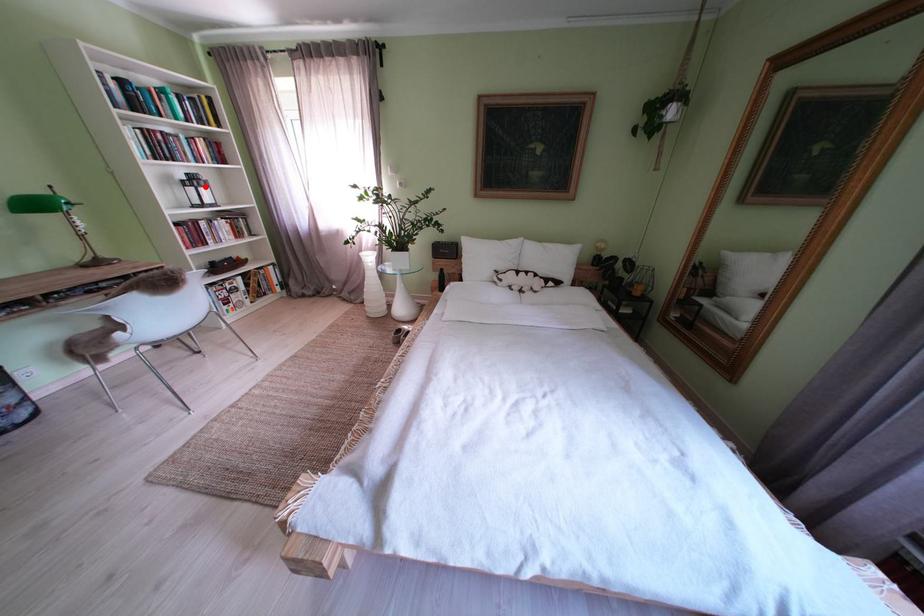
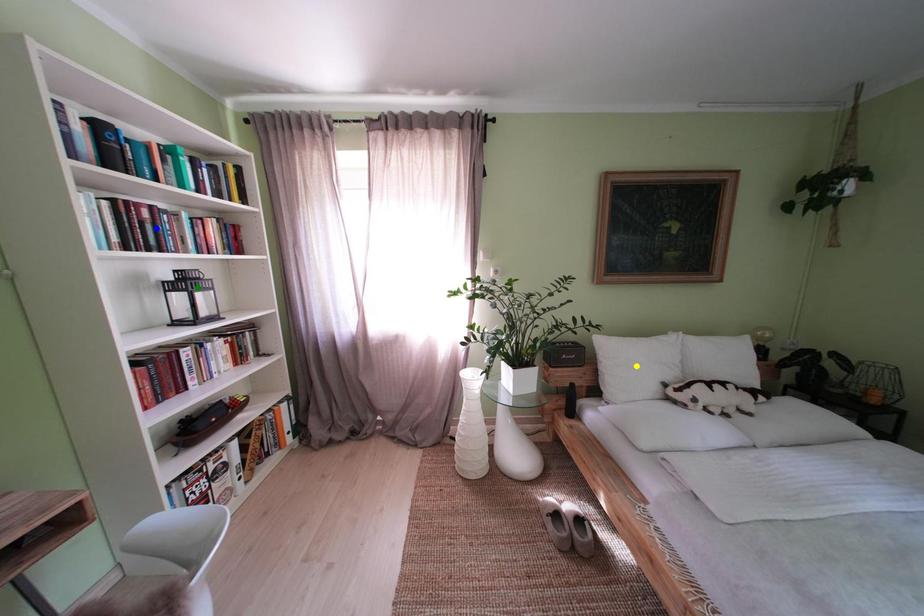
Question: I am providing you with two images of the same scene from different viewpoints. A red point is marked on the first image. You are given multiple points on the second image. Which mark in image 2 goes with the point in image 1?

Choices:
 (A) yellow point
 (B) blue point
 (C) green point

Answer: (C)